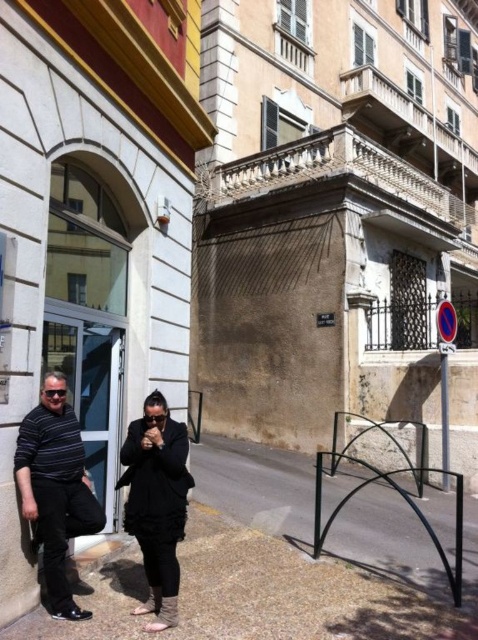
Question: Can you confirm if striped cotton shirt at left is thinner than black matte coat at center?

Choices:
 (A) yes
 (B) no

Answer: (B)

Question: Estimate the real-world distances between objects in this image. Which object is closer to the black matte coat at center?

Choices:
 (A) striped cotton shirt at left
 (B) black matte clothing at center

Answer: (B)

Question: Among these points, which one is farthest from the camera?

Choices:
 (A) (350, 474)
 (B) (26, 470)
 (C) (52, 401)
 (D) (147, 545)

Answer: (A)

Question: Is black metal bike rack at lower center bigger than black matte clothing at center?

Choices:
 (A) no
 (B) yes

Answer: (B)

Question: Which of the following is the closest to the observer?

Choices:
 (A) striped cotton shirt at left
 (B) black metal bike rack at lower center

Answer: (A)

Question: Is black metal bike rack at lower center to the right of black matte clothing at center from the viewer's perspective?

Choices:
 (A) no
 (B) yes

Answer: (B)